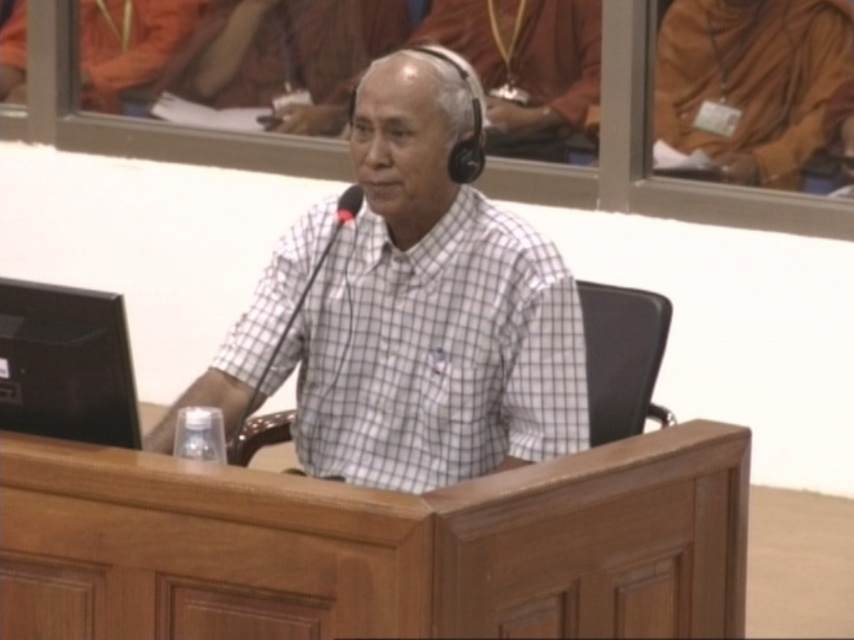
You are standing in the courtroom and need to place a small object exactly at the point with coordinates point (375, 547). Is this point located on the wooden table at center?

Yes, the point (375, 547) is on the wooden table at center, so placing the object there is possible.

You are standing in front of the wooden desk in the courtroom scene. There is a point marked at coordinates [375,547]. What object is located at that point?

The point at coordinates [375,547] indicates the wooden table at center.

You are a delivery person who needs to place a package between the wooden table at center and the brown clothed monk at upper right. The package requires a minimum of 3 meters of space to safely place it. Can you fit the package between them?

The wooden table at center and brown clothed monk at upper right are 2.82 meters apart, which is less than the required 3 meters. Therefore, the package cannot be safely placed between them.